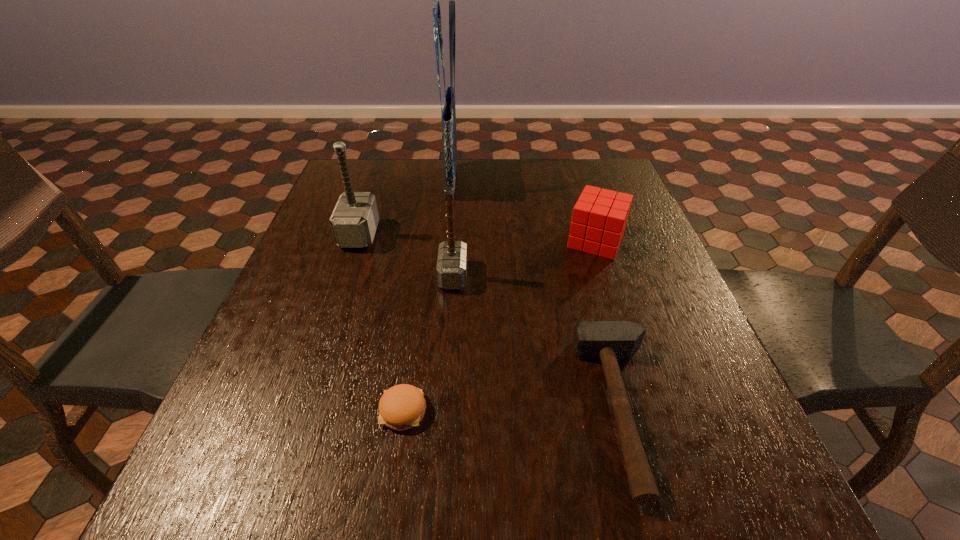
This screenshot has height=540, width=960. Find the location of `the farthest object`. the farthest object is located at coordinates coord(448,116).

Where is `shopping bag`? The image size is (960, 540). shopping bag is located at coordinates (448, 116).

Where is `the farthest hammer`? the farthest hammer is located at coordinates pyautogui.click(x=354, y=220).

You are a GUI agent. You are given a task and a screenshot of the screen. Output one action in this format:
    pyautogui.click(x=<x>, y=<y>)
    Task: Click on the leftmost hammer
    Image resolution: width=960 pixels, height=540 pixels.
    Given the screenshot: What is the action you would take?
    pyautogui.click(x=354, y=220)

Locate an element on the screen. The height and width of the screenshot is (540, 960). the second hammer from right to left is located at coordinates (451, 269).

The width and height of the screenshot is (960, 540). I want to click on the third shortest object, so click(x=599, y=218).

Identify the location of the nearest hammer. (608, 341).

This screenshot has height=540, width=960. I want to click on the rightmost hammer, so click(608, 341).

The width and height of the screenshot is (960, 540). In order to click on patty in this screenshot , I will do `click(401, 407)`.

Locate an element on the screen. This screenshot has height=540, width=960. vacant space located on the front-facing side of the shopping bag is located at coordinates (563, 181).